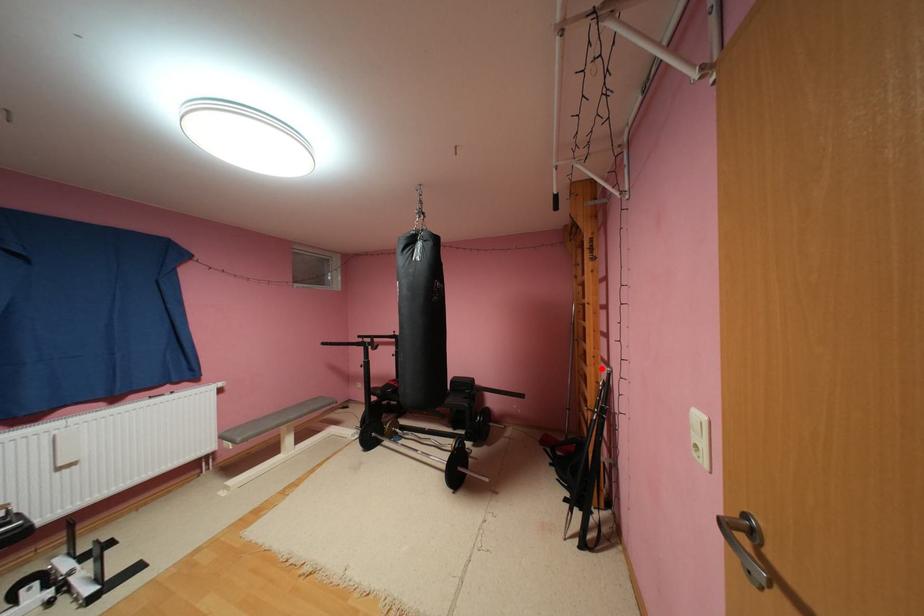
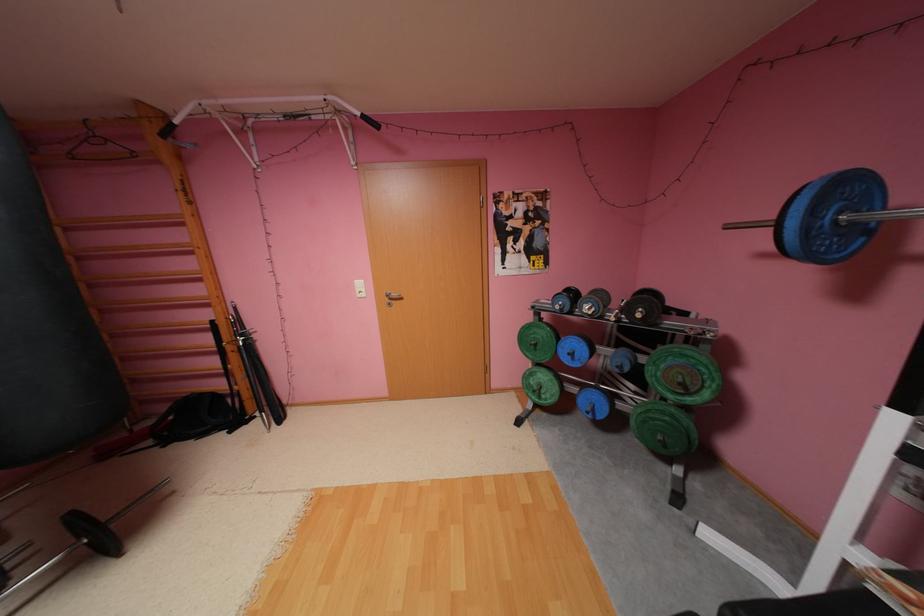
The point at the highlighted location is marked in the first image. Where is the corresponding point in the second image?

(227, 308)